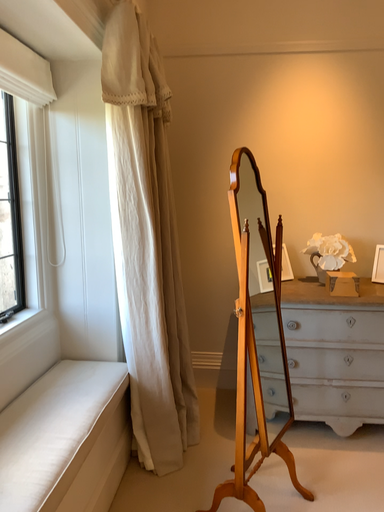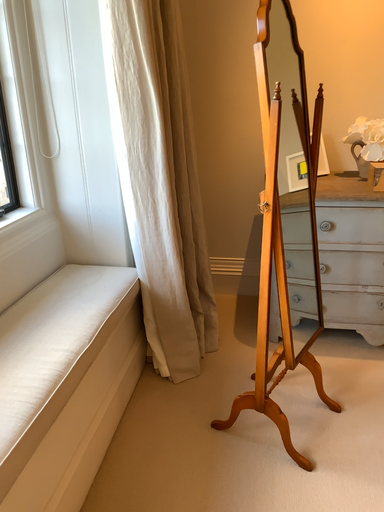
Question: Which way did the camera rotate in the video?

Choices:
 (A) rotated downward
 (B) rotated upward

Answer: (A)